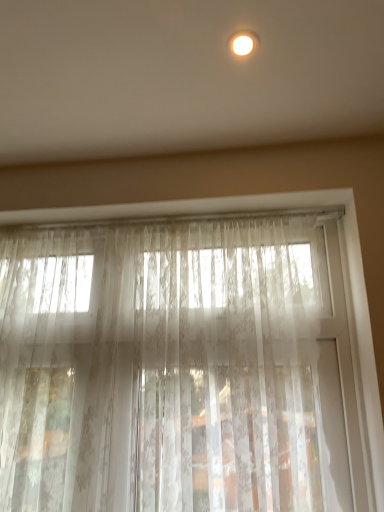
The width and height of the screenshot is (384, 512). Describe the element at coordinates (243, 42) in the screenshot. I see `matte white light fixture at upper center` at that location.

Identify the location of matte white light fixture at upper center. (243, 42).

This screenshot has width=384, height=512. I want to click on sheer white lace curtain at center, so click(x=174, y=368).

Measure the distance between point (135,448) and camera.

1.26 meters.

Describe the element at coordinates (174, 368) in the screenshot. The height and width of the screenshot is (512, 384). I see `sheer white lace curtain at center` at that location.

Identify the location of matte white light fixture at upper center. This screenshot has height=512, width=384. (243, 42).

Considering the relative positions of sheer white lace curtain at center and matte white light fixture at upper center in the image provided, is sheer white lace curtain at center to the left of matte white light fixture at upper center from the viewer's perspective?

Yes.

Considering their positions, is sheer white lace curtain at center located in front of or behind matte white light fixture at upper center?

In the image, sheer white lace curtain at center appears behind matte white light fixture at upper center.

Which point is more distant from viewer, [157,246] or [238,34]?

The point [157,246] is farther from the camera.

From the image's perspective, between sheer white lace curtain at center and matte white light fixture at upper center, who is located below?

From the image's view, sheer white lace curtain at center is below.

From a real-world perspective, is sheer white lace curtain at center physically located above or below matte white light fixture at upper center?

From a real-world perspective, sheer white lace curtain at center is physically below matte white light fixture at upper center.

Considering the sizes of objects sheer white lace curtain at center and matte white light fixture at upper center in the image provided, who is wider, sheer white lace curtain at center or matte white light fixture at upper center?

matte white light fixture at upper center.

Is sheer white lace curtain at center taller than matte white light fixture at upper center?

Yes.

Can you confirm if sheer white lace curtain at center is smaller than matte white light fixture at upper center?

Incorrect, sheer white lace curtain at center is not smaller in size than matte white light fixture at upper center.

Is sheer white lace curtain at center located outside matte white light fixture at upper center?

Indeed, sheer white lace curtain at center is completely outside matte white light fixture at upper center.

Would you say sheer white lace curtain at center is a long distance from matte white light fixture at upper center?

That's not correct — sheer white lace curtain at center is a little close to matte white light fixture at upper center.

Is sheer white lace curtain at center facing away from matte white light fixture at upper center?

No, sheer white lace curtain at center is not facing the opposite direction of matte white light fixture at upper center.

Can you tell me how much sheer white lace curtain at center and matte white light fixture at upper center differ in facing direction?

97 degrees separate the facing orientations of sheer white lace curtain at center and matte white light fixture at upper center.

I want to click on curtain on the left of matte white light fixture at upper center, so click(x=174, y=368).

Does matte white light fixture at upper center appear on the right side of sheer white lace curtain at center?

Correct, you'll find matte white light fixture at upper center to the right of sheer white lace curtain at center.

Does matte white light fixture at upper center come in front of sheer white lace curtain at center?

Answer: Yes, matte white light fixture at upper center is in front of sheer white lace curtain at center.

Which is further, (251, 41) or (284, 504)?

Positioned behind is point (284, 504).

From the image's perspective, which is below, matte white light fixture at upper center or sheer white lace curtain at center?

sheer white lace curtain at center is shown below in the image.

From a real-world perspective, is matte white light fixture at upper center on top of sheer white lace curtain at center?

Yes.

Consider the image. Is matte white light fixture at upper center wider or thinner than sheer white lace curtain at center?

matte white light fixture at upper center is wider than sheer white lace curtain at center.

Considering the relative sizes of matte white light fixture at upper center and sheer white lace curtain at center in the image provided, is matte white light fixture at upper center taller than sheer white lace curtain at center?

In fact, matte white light fixture at upper center may be shorter than sheer white lace curtain at center.

Is matte white light fixture at upper center smaller than sheer white lace curtain at center?

Correct, matte white light fixture at upper center occupies less space than sheer white lace curtain at center.

Is matte white light fixture at upper center located outside sheer white lace curtain at center?

Yes.

Is matte white light fixture at upper center far away from sheer white lace curtain at center?

Actually, matte white light fixture at upper center and sheer white lace curtain at center are a little close together.

Could you tell me if matte white light fixture at upper center is facing sheer white lace curtain at center?

No.

How many degrees apart are the facing directions of matte white light fixture at upper center and sheer white lace curtain at center?

The angle between the facing direction of matte white light fixture at upper center and the facing direction of sheer white lace curtain at center is 97 degrees.

Measure the distance from matte white light fixture at upper center to sheer white lace curtain at center.

matte white light fixture at upper center is 37.79 inches from sheer white lace curtain at center.

Identify the location of curtain located behind the matte white light fixture at upper center. This screenshot has width=384, height=512. (174, 368).

This screenshot has width=384, height=512. I want to click on curtain behind the matte white light fixture at upper center, so click(x=174, y=368).

Find the location of a particular element. This screenshot has height=512, width=384. curtain on the left of matte white light fixture at upper center is located at coordinates (174, 368).